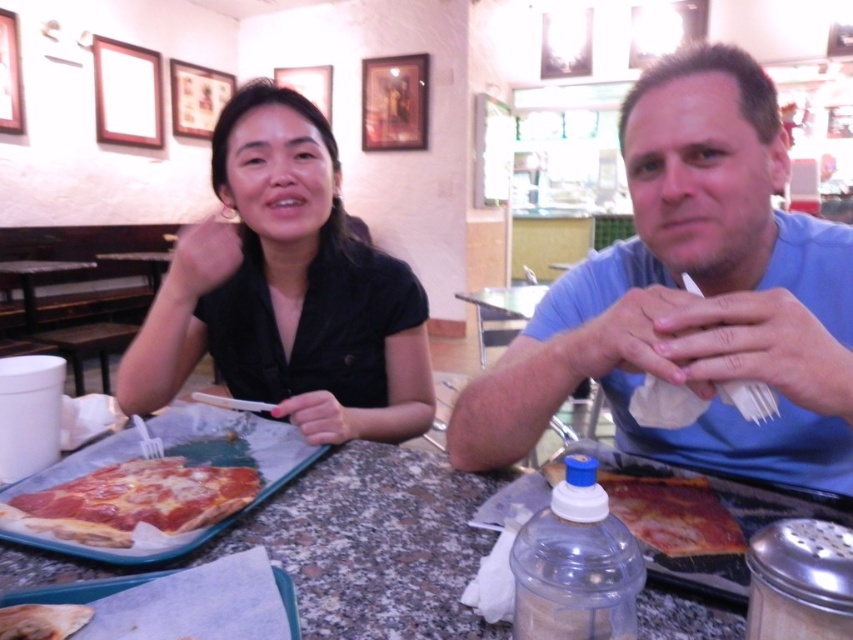
Question: Is black matte shirt at center thinner than cheesy pizza at center?

Choices:
 (A) no
 (B) yes

Answer: (A)

Question: Is granite table at center wider than cheese pizza tray at center?

Choices:
 (A) no
 (B) yes

Answer: (B)

Question: Among these objects, which one is farthest from the camera?

Choices:
 (A) black matte shirt at center
 (B) wooden picture frame at upper center

Answer: (B)

Question: Among these points, which one is nearest to the camera?

Choices:
 (A) (473, 396)
 (B) (45, 504)

Answer: (B)

Question: Which is farther from the cheese pizza tray at center?

Choices:
 (A) granite table at center
 (B) black matte shirt at center

Answer: (B)

Question: From the image, what is the correct spatial relationship of blue cotton shirt at center in relation to black matte shirt at center?

Choices:
 (A) right
 (B) left

Answer: (A)